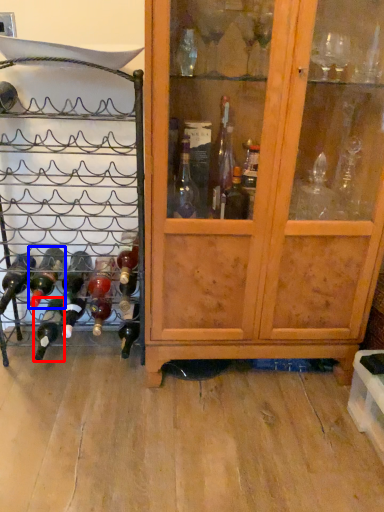
Question: Which object appears farthest to the camera in this image, bottle (highlighted by a red box) or bottle (highlighted by a blue box)?

Choices:
 (A) bottle
 (B) bottle

Answer: (A)